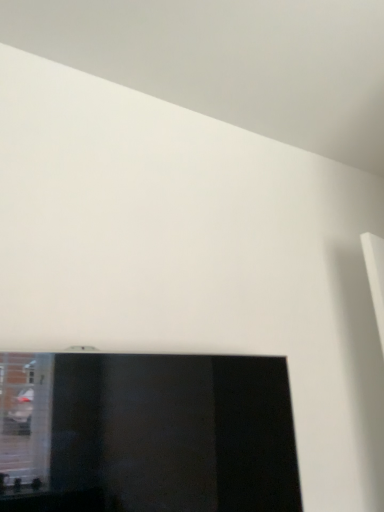
Locate an element on the screen. The height and width of the screenshot is (512, 384). matte black monitor at lower center is located at coordinates (175, 432).

Measure the distance between point [195,396] and camera.

A distance of 1.05 meters exists between point [195,396] and camera.

What do you see at coordinates (175, 432) in the screenshot?
I see `matte black monitor at lower center` at bounding box center [175, 432].

At what (x,y) coordinates should I click in order to perform the action: click on matte black monitor at lower center. Please return your answer as a coordinate pair (x, y). Looking at the image, I should click on (175, 432).